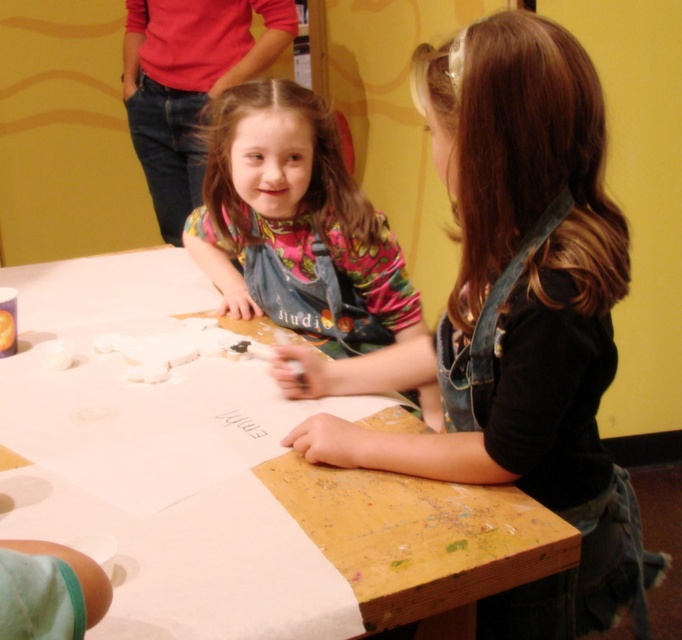
Between white paper at center and matte denim apron at center, which one appears on the left side from the viewer's perspective?

white paper at center is more to the left.

Is point (149, 291) behind point (329, 332)?

Yes, point (149, 291) is behind point (329, 332).

Is point (364, 500) farther from camera compared to point (338, 234)?

No, it is not.

This screenshot has width=682, height=640. I want to click on white paper at center, so pyautogui.click(x=419, y=540).

Is denim overalls at center in front of white paper at center?

Yes, it is in front of white paper at center.

Is point (338, 419) farther from viewer compared to point (186, 541)?

Yes, point (338, 419) is farther from viewer.

Between point (561, 436) and point (155, 284), which one is positioned behind?

Point (155, 284)

Identify the location of denim overalls at center. This screenshot has width=682, height=640. (514, 321).

Does denim overalls at center have a smaller size compared to matte denim apron at center?

No, denim overalls at center is not smaller than matte denim apron at center.

Is point (604, 136) closer to camera compared to point (370, 344)?

Yes, it is.

Is point (312, 374) closer to viewer compared to point (286, 90)?

That is True.

Identify the location of denim overalls at center. click(514, 321).